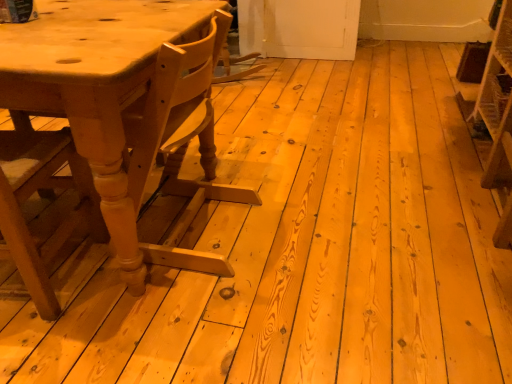
I want to click on vacant area that lies to the right of wooden chair at left, so (124, 308).